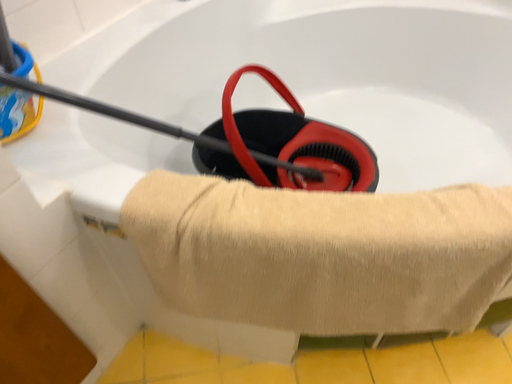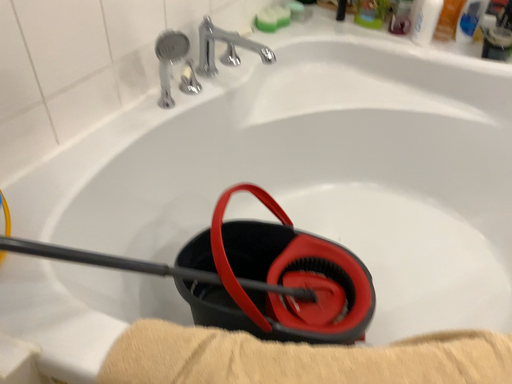
Question: How did the camera likely rotate when shooting the video?

Choices:
 (A) rotated downward
 (B) rotated upward

Answer: (B)